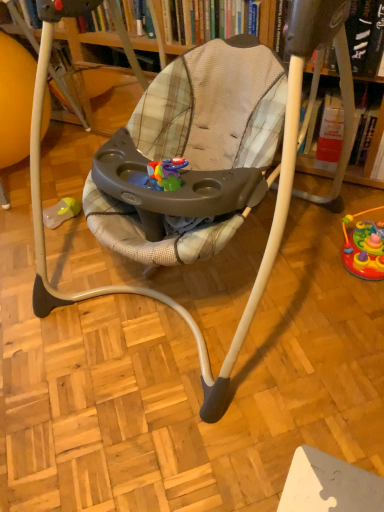
Find the location of a particular element. The width and height of the screenshot is (384, 512). vacant region to the left of rubberized plastic toy at lower right is located at coordinates (307, 262).